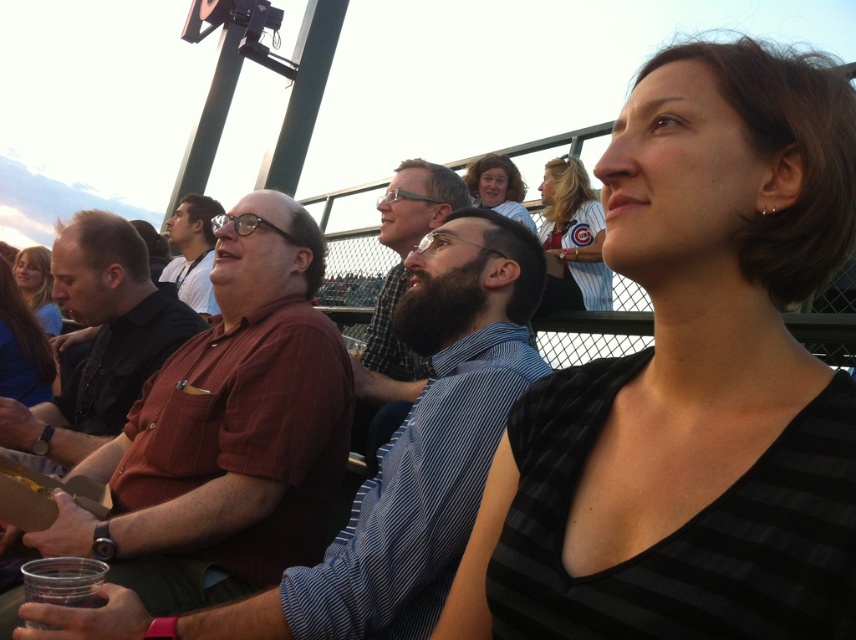
Question: Observing the image, what is the correct spatial positioning of brown shirt at center in reference to blonde hair at center?

Choices:
 (A) above
 (B) below

Answer: (A)

Question: Estimate the real-world distances between objects in this image. Which object is farther from the matte brown hair at upper center?

Choices:
 (A) black shirt at left
 (B) matte brown shirt at center
 (C) black striped shirt at upper right

Answer: (C)

Question: Which object is closer to the camera taking this photo?

Choices:
 (A) matte brown shirt at center
 (B) matte brown hair at upper center
 (C) brown shirt at center
 (D) white striped jersey at upper center

Answer: (A)

Question: Estimate the real-world distances between objects in this image. Which object is closer to the black shirt at left?

Choices:
 (A) matte brown hair at upper center
 (B) blue fabric shirt at lower left

Answer: (B)

Question: From the image, what is the correct spatial relationship of brown shirt at center in relation to blonde hair at center?

Choices:
 (A) below
 (B) above

Answer: (B)

Question: Does bearded man at center have a greater width compared to blonde hair at center?

Choices:
 (A) no
 (B) yes

Answer: (A)